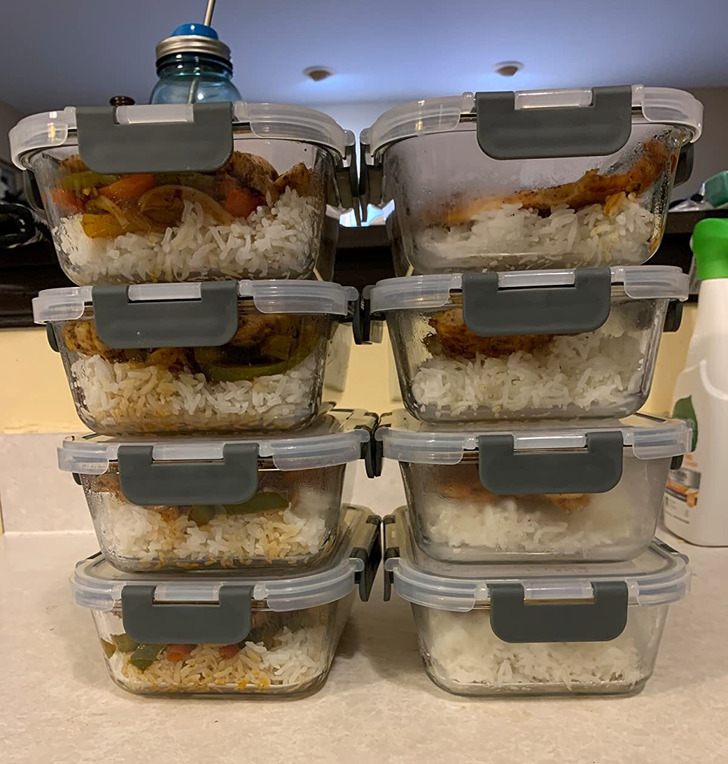
You are a GUI agent. You are given a task and a screenshot of the screen. Output one action in this format:
    pyautogui.click(x=<x>, y=<y>)
    Task: Click on the white ceiling
    The width and height of the screenshot is (728, 764).
    Given the screenshot: What is the action you would take?
    pyautogui.click(x=376, y=41)